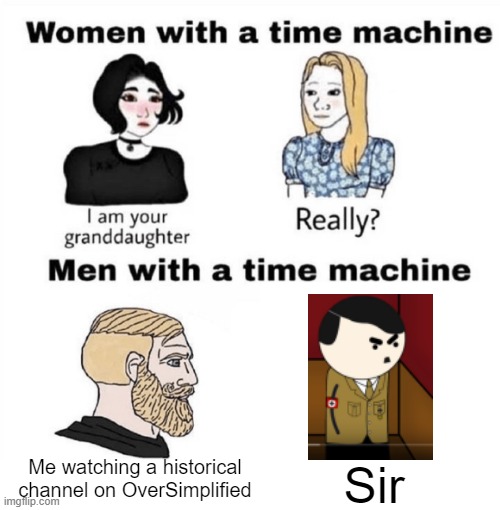
The height and width of the screenshot is (510, 500). I want to click on picture, so click(x=379, y=358).